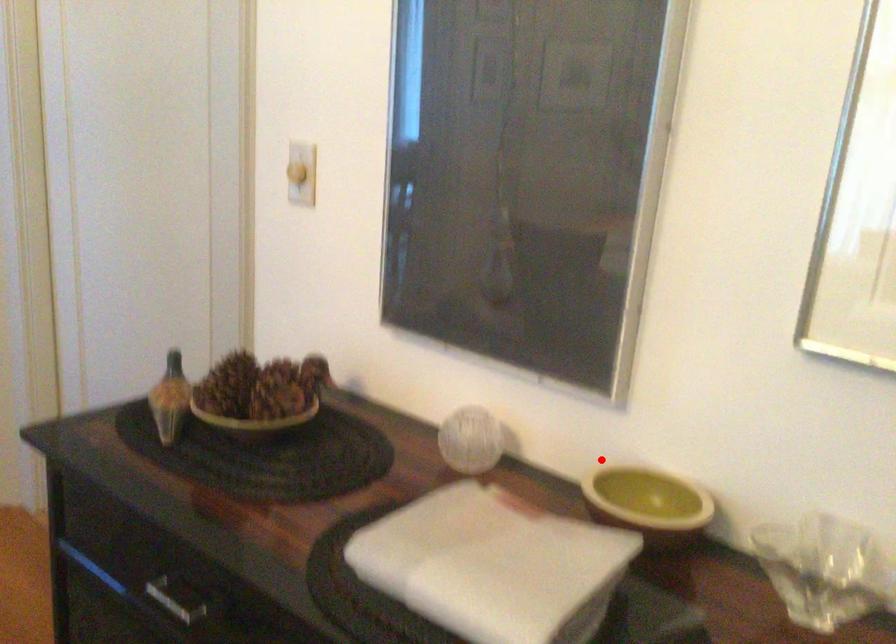
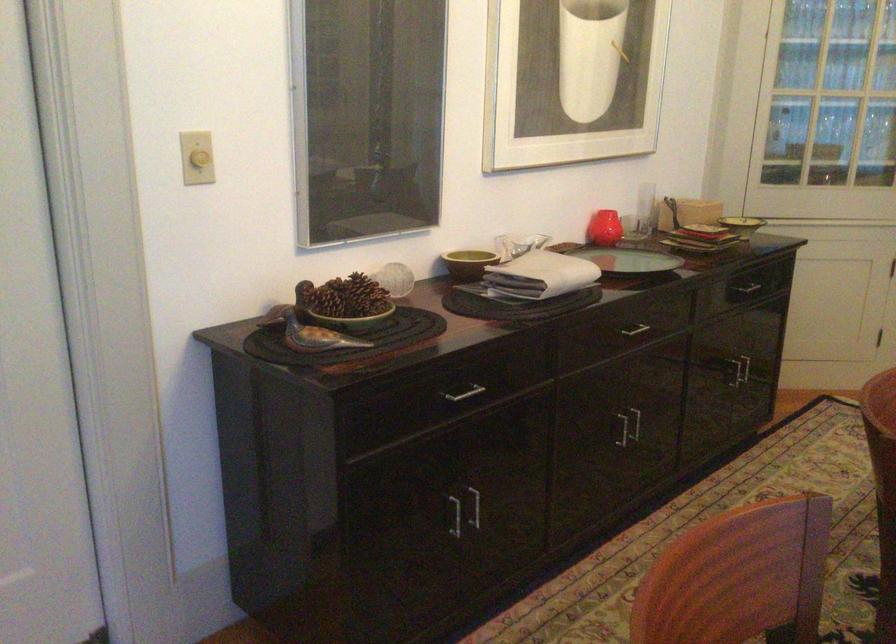
Question: I am providing you with two images of the same scene from different viewpoints. In image1, a red point is highlighted. Considering the same 3D point in image2, which of the following is correct?

Choices:
 (A) It is closer
 (B) It is farther

Answer: (B)